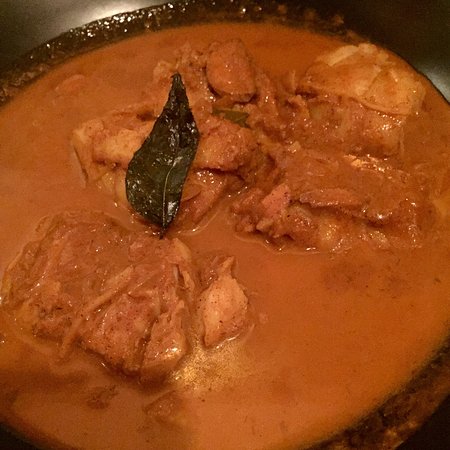
At what (x,y) coordinates should I click in order to perform the action: click on upper left rim of bowl. Please return your answer as a coordinate pair (x, y). The image size is (450, 450). Looking at the image, I should click on (38, 54).